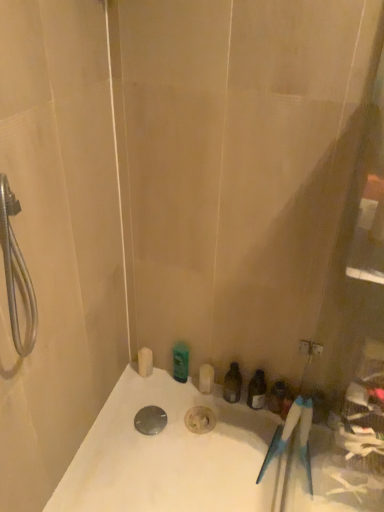
The height and width of the screenshot is (512, 384). I want to click on vacant space in front of matte plastic toiletries at lower right, which appears as the first toiletry when viewed from the right, so click(x=267, y=454).